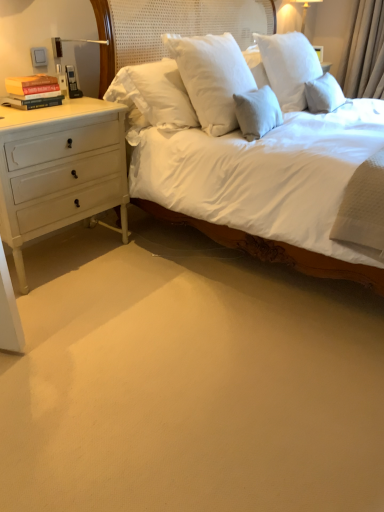
Question: Does beige fabric curtain at upper right have a greater width compared to white painted wood chest of drawers at left?

Choices:
 (A) yes
 (B) no

Answer: (B)

Question: Does beige fabric curtain at upper right have a lesser width compared to white painted wood chest of drawers at left?

Choices:
 (A) yes
 (B) no

Answer: (A)

Question: Is beige fabric curtain at upper right positioned far away from white painted wood chest of drawers at left?

Choices:
 (A) no
 (B) yes

Answer: (B)

Question: From the image's perspective, is beige fabric curtain at upper right beneath white painted wood chest of drawers at left?

Choices:
 (A) no
 (B) yes

Answer: (A)

Question: Is the position of beige fabric curtain at upper right less distant than that of white painted wood chest of drawers at left?

Choices:
 (A) yes
 (B) no

Answer: (B)

Question: In terms of height, does hardcover books at left look taller or shorter compared to white glossy lampshade at upper right?

Choices:
 (A) short
 (B) tall

Answer: (A)

Question: Based on their positions, is hardcover books at left located to the left or right of white glossy lampshade at upper right?

Choices:
 (A) right
 (B) left

Answer: (B)

Question: Does point (41, 75) appear closer or farther from the camera than point (301, 22)?

Choices:
 (A) farther
 (B) closer

Answer: (B)

Question: In the image, is hardcover books at left positioned in front of or behind white glossy lampshade at upper right?

Choices:
 (A) front
 (B) behind

Answer: (A)

Question: Is point (33, 158) closer or farther from the camera than point (372, 53)?

Choices:
 (A) farther
 (B) closer

Answer: (B)

Question: Is white painted wood chest of drawers at left taller or shorter than beige fabric curtain at upper right?

Choices:
 (A) short
 (B) tall

Answer: (A)

Question: Is white painted wood chest of drawers at left in front of or behind beige fabric curtain at upper right in the image?

Choices:
 (A) front
 (B) behind

Answer: (A)

Question: Is white painted wood chest of drawers at left bigger or smaller than beige fabric curtain at upper right?

Choices:
 (A) small
 (B) big

Answer: (B)

Question: Is white glossy lampshade at upper right bigger or smaller than hardcover books at left?

Choices:
 (A) big
 (B) small

Answer: (A)

Question: Considering the positions of point (291, 0) and point (46, 93), is point (291, 0) closer or farther from the camera than point (46, 93)?

Choices:
 (A) farther
 (B) closer

Answer: (A)